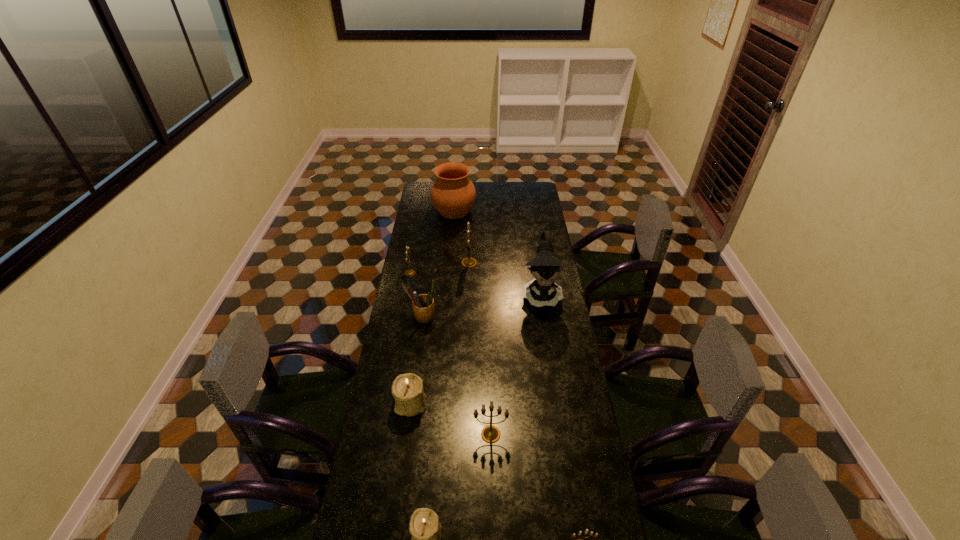
Image resolution: width=960 pixels, height=540 pixels. I want to click on doll, so click(545, 267).

Locate an element on the screen. This screenshot has height=540, width=960. pottery is located at coordinates (453, 194).

Locate an element on the screen. The width and height of the screenshot is (960, 540). the biggest gold candelabrum is located at coordinates (468, 262).

You are a GUI agent. You are given a task and a screenshot of the screen. Output one action in this format:
    pyautogui.click(x=<x>, y=<y>)
    Task: Click on the brown pencil box
    This screenshot has width=960, height=540.
    Given the screenshot: What is the action you would take?
    pyautogui.click(x=423, y=305)

You are a GUI agent. You are given a task and a screenshot of the screen. Output one action in this format:
    pyautogui.click(x=<x>, y=<y>)
    Task: Click on the second biggest gold candelabrum
    The height and width of the screenshot is (540, 960).
    Given the screenshot: What is the action you would take?
    pyautogui.click(x=490, y=434)

Locate an element on the screen. This screenshot has width=960, height=540. the third nearest object is located at coordinates (490, 434).

Image resolution: width=960 pixels, height=540 pixels. Find the location of `the farther beige candle_holder`. the farther beige candle_holder is located at coordinates (407, 389).

Locate an element on the screen. The width and height of the screenshot is (960, 540). the bigger beige candle_holder is located at coordinates (407, 389).

Where is `the leftmost gold candelabrum`? The width and height of the screenshot is (960, 540). the leftmost gold candelabrum is located at coordinates (411, 272).

Locate an element on the screen. This screenshot has height=540, width=960. free space located at the face of the doll is located at coordinates (554, 376).